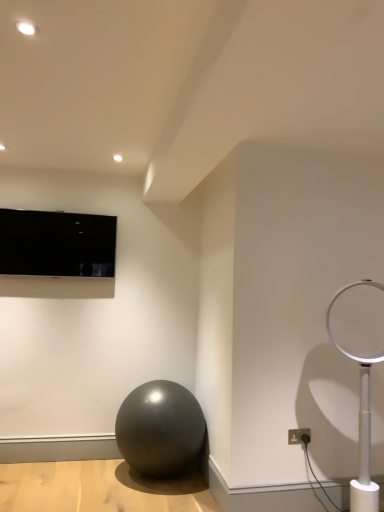
Where is `vacant space in front of shiny black ball at center`? vacant space in front of shiny black ball at center is located at coordinates (149, 500).